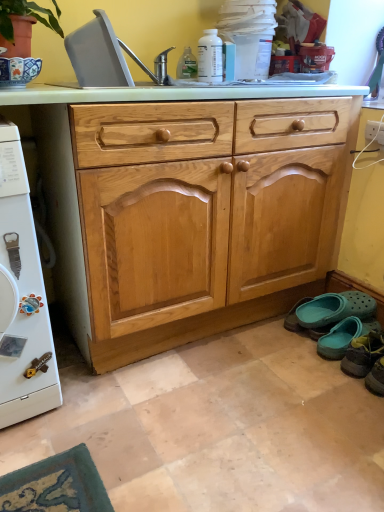
Describe the element at coordinates (363, 354) in the screenshot. I see `teal fabric slipper at lower right, positioned as the 2th footwear in back-to-front order` at that location.

You are a GUI agent. You are given a task and a screenshot of the screen. Output one action in this format:
    pyautogui.click(x=<x>, y=<y>)
    Task: Click on the teal rubber clogs at lower right, which is the 2th footwear from front to back
    This screenshot has height=512, width=384.
    Given the screenshot: What is the action you would take?
    pyautogui.click(x=335, y=308)

At what (x,y) coordinates should I click in order to perform the action: click on sink above the teal fabric slipper at lower right, which is the 1th footwear in front-to-back order (from the image's perspective). Please return your answer as a coordinate pair (x, y). Looking at the image, I should click on [x=107, y=56].

Can we say gray plastic sink at upper left lies outside teal fabric slipper at lower right, positioned as the 2th footwear in back-to-front order?

Yes, gray plastic sink at upper left is outside of teal fabric slipper at lower right, positioned as the 2th footwear in back-to-front order.

Does gray plastic sink at upper left appear on the left side of teal fabric slipper at lower right, which is the 1th footwear in front-to-back order?

Indeed, gray plastic sink at upper left is positioned on the left side of teal fabric slipper at lower right, which is the 1th footwear in front-to-back order.

Is gray plastic sink at upper left shorter than teal fabric slipper at lower right, which is the 1th footwear in front-to-back order?

No, gray plastic sink at upper left is not shorter than teal fabric slipper at lower right, which is the 1th footwear in front-to-back order.

Between teal rubber clogs at lower right, which is the 2th footwear from front to back, and teal fabric slipper at lower right, which is the 1th footwear in front-to-back order, which one has larger size?

Bigger between the two is teal fabric slipper at lower right, which is the 1th footwear in front-to-back order.

Is teal fabric slipper at lower right, positioned as the 2th footwear in back-to-front order, at the back of teal rubber clogs at lower right, the first footwear from the back?

teal rubber clogs at lower right, the first footwear from the back, is not turned away from teal fabric slipper at lower right, positioned as the 2th footwear in back-to-front order.

From a real-world perspective, which is physically below, teal rubber clogs at lower right, the first footwear from the back, or teal fabric slipper at lower right, which is the 1th footwear in front-to-back order?

teal rubber clogs at lower right, the first footwear from the back.

Measure the distance from teal rubber clogs at lower right, the first footwear from the back, to gray plastic sink at upper left.

teal rubber clogs at lower right, the first footwear from the back, is 3.72 feet from gray plastic sink at upper left.

Considering the relative positions of teal rubber clogs at lower right, which is the 2th footwear from front to back, and gray plastic sink at upper left in the image provided, is teal rubber clogs at lower right, which is the 2th footwear from front to back, to the left of gray plastic sink at upper left from the viewer's perspective?

No.

From the image's perspective, does teal rubber clogs at lower right, which is the 2th footwear from front to back, appear higher than gray plastic sink at upper left?

No, from the image's perspective, teal rubber clogs at lower right, which is the 2th footwear from front to back, is not on top of gray plastic sink at upper left.

Can you tell me how much teal rubber clogs at lower right, which is the 2th footwear from front to back, and gray plastic sink at upper left differ in facing direction?

There is a 92.2-degree angle between the facing directions of teal rubber clogs at lower right, which is the 2th footwear from front to back, and gray plastic sink at upper left.

Is light wood drawer at center wider than teal fabric slipper at lower right, positioned as the 2th footwear in back-to-front order?

Indeed, light wood drawer at center has a greater width compared to teal fabric slipper at lower right, positioned as the 2th footwear in back-to-front order.

The image size is (384, 512). I want to click on footwear that is the 2nd object located below the light wood drawer at center (from the image's perspective), so click(x=363, y=354).

Is light wood drawer at center turned away from teal fabric slipper at lower right, which is the 1th footwear in front-to-back order?

No, teal fabric slipper at lower right, which is the 1th footwear in front-to-back order, is not at the back of light wood drawer at center.

Is light wood drawer at center at the right side of teal fabric slipper at lower right, positioned as the 2th footwear in back-to-front order?

Incorrect, light wood drawer at center is not on the right side of teal fabric slipper at lower right, positioned as the 2th footwear in back-to-front order.

Who is smaller, gray plastic sink at upper left or teal rubber clogs at lower right, which is the 2th footwear from front to back?

With smaller size is teal rubber clogs at lower right, which is the 2th footwear from front to back.

From a real-world perspective, is gray plastic sink at upper left physically below teal rubber clogs at lower right, the first footwear from the back?

Actually, gray plastic sink at upper left is physically above teal rubber clogs at lower right, the first footwear from the back, in the real world.

Measure the distance from gray plastic sink at upper left to teal rubber clogs at lower right, which is the 2th footwear from front to back.

The distance of gray plastic sink at upper left from teal rubber clogs at lower right, which is the 2th footwear from front to back, is 1.13 meters.

Looking at this image, is gray plastic sink at upper left not within teal rubber clogs at lower right, the first footwear from the back?

Yes.

How far apart are light wood drawer at center and gray plastic sink at upper left?

light wood drawer at center and gray plastic sink at upper left are 12.39 inches apart from each other.

In the image, is light wood drawer at center positioned in front of or behind gray plastic sink at upper left?

In the image, light wood drawer at center appears in front of gray plastic sink at upper left.

Does light wood drawer at center contain gray plastic sink at upper left?

No.

Is light wood drawer at center to the right of teal rubber clogs at lower right, the first footwear from the back, from the viewer's perspective?

In fact, light wood drawer at center is to the left of teal rubber clogs at lower right, the first footwear from the back.

From the image's perspective, which one is positioned higher, light wood drawer at center or teal rubber clogs at lower right, the first footwear from the back?

light wood drawer at center is shown above in the image.

Does point (87, 106) appear closer or farther from the camera than point (354, 312)?

Point (87, 106).

I want to click on sink above the teal fabric slipper at lower right, positioned as the 2th footwear in back-to-front order (from a real-world perspective), so pos(107,56).

I want to click on footwear behind the teal fabric slipper at lower right, which is the 1th footwear in front-to-back order, so click(335, 308).

Estimate the real-world distances between objects in this image. Which object is further from teal rubber clogs at lower right, the first footwear from the back, gray plastic sink at upper left or light wood drawer at center?

The object further to teal rubber clogs at lower right, the first footwear from the back, is gray plastic sink at upper left.

Looking at the image, which one is located closer to teal fabric slipper at lower right, which is the 1th footwear in front-to-back order, teal rubber clogs at lower right, the first footwear from the back, or light wood drawer at center?

teal rubber clogs at lower right, the first footwear from the back, is closer to teal fabric slipper at lower right, which is the 1th footwear in front-to-back order.

When comparing their distances from light wood drawer at center, does teal rubber clogs at lower right, the first footwear from the back, or teal fabric slipper at lower right, which is the 1th footwear in front-to-back order, seem closer?

teal rubber clogs at lower right, the first footwear from the back, lies closer to light wood drawer at center than the other object.

When comparing their distances from teal fabric slipper at lower right, which is the 1th footwear in front-to-back order, does gray plastic sink at upper left or light wood drawer at center seem further?

gray plastic sink at upper left.

Based on their spatial positions, is gray plastic sink at upper left or teal fabric slipper at lower right, positioned as the 2th footwear in back-to-front order, further from teal rubber clogs at lower right, which is the 2th footwear from front to back?

Based on the image, gray plastic sink at upper left appears to be further to teal rubber clogs at lower right, which is the 2th footwear from front to back.

Estimate the real-world distances between objects in this image. Which object is closer to light wood drawer at center, teal rubber clogs at lower right, the first footwear from the back, or gray plastic sink at upper left?

Among the two, gray plastic sink at upper left is located nearer to light wood drawer at center.

From the image, which object appears to be farther from teal fabric slipper at lower right, which is the 1th footwear in front-to-back order, gray plastic sink at upper left or teal rubber clogs at lower right, which is the 2th footwear from front to back?

gray plastic sink at upper left lies further to teal fabric slipper at lower right, which is the 1th footwear in front-to-back order, than the other object.

Looking at the image, which one is located closer to gray plastic sink at upper left, teal fabric slipper at lower right, which is the 1th footwear in front-to-back order, or light wood drawer at center?

light wood drawer at center is positioned closer to the anchor gray plastic sink at upper left.

Where is `drawer between gray plastic sink at upper left and teal rubber clogs at lower right, the first footwear from the back, in the vertical direction`? The height and width of the screenshot is (512, 384). drawer between gray plastic sink at upper left and teal rubber clogs at lower right, the first footwear from the back, in the vertical direction is located at coordinates (202, 129).

The image size is (384, 512). Identify the location of drawer between gray plastic sink at upper left and teal fabric slipper at lower right, which is the 1th footwear in front-to-back order, vertically. (202, 129).

You are a GUI agent. You are given a task and a screenshot of the screen. Output one action in this format:
    pyautogui.click(x=<x>, y=<y>)
    Task: Click on the footwear between light wood drawer at center and teal fabric slipper at lower right, positioned as the 2th footwear in back-to-front order, in the vertical direction
    The image size is (384, 512).
    Given the screenshot: What is the action you would take?
    pyautogui.click(x=335, y=308)

Identify the location of footwear between gray plastic sink at upper left and teal fabric slipper at lower right, which is the 1th footwear in front-to-back order, from top to bottom. (335, 308).